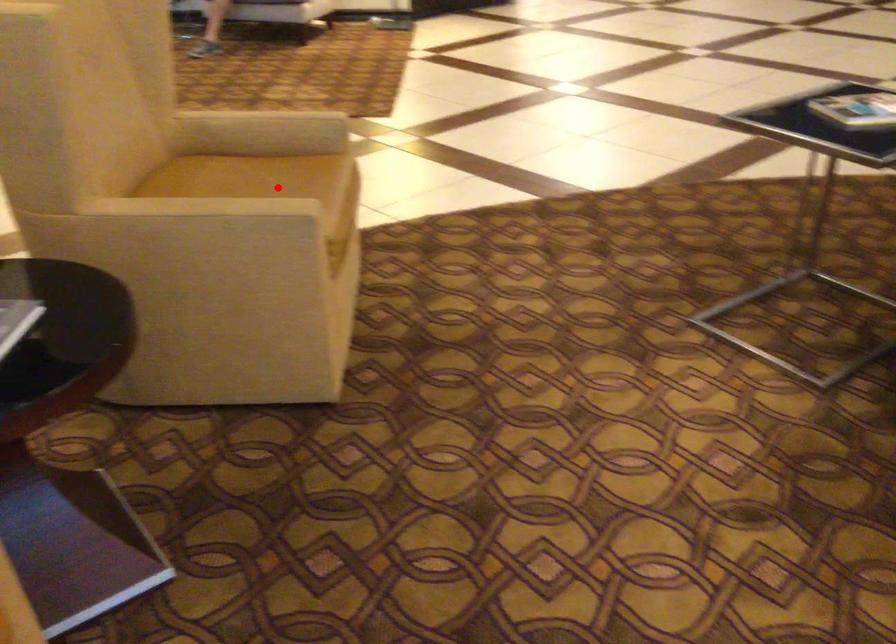
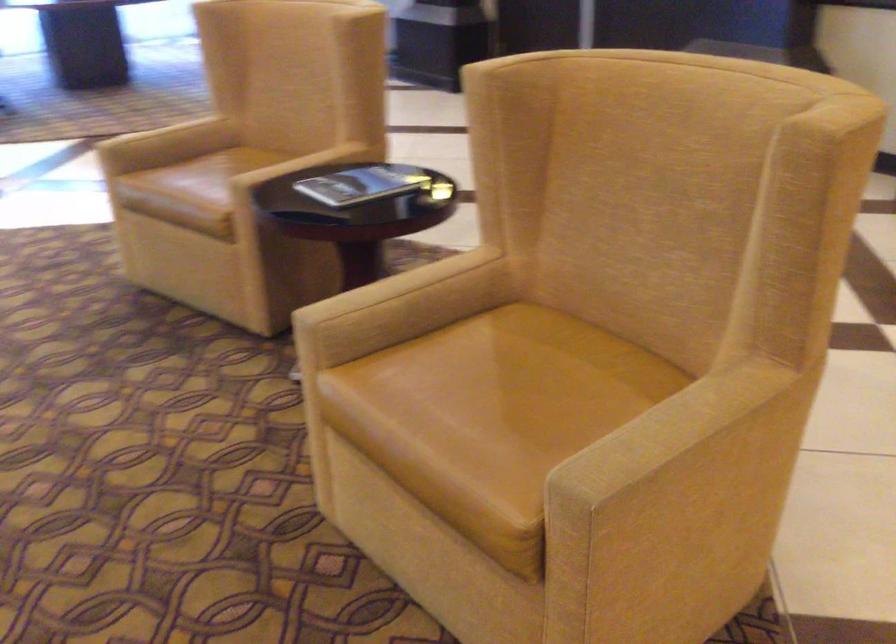
Find the pixel in the second image that matches the highlighted location in the first image.

(500, 398)